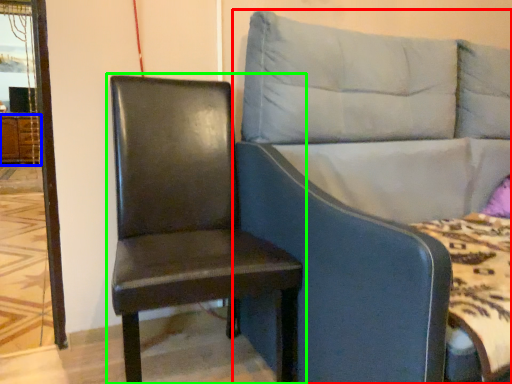
Question: Considering the real-world distances, which object is farthest from studio couch (highlighted by a red box)? dresser (highlighted by a blue box) or chair (highlighted by a green box)?

Choices:
 (A) dresser
 (B) chair

Answer: (A)